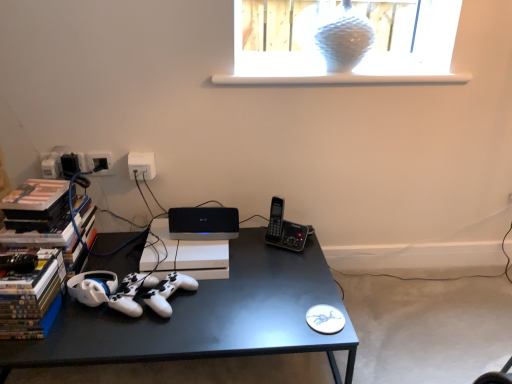
What are the coordinates of `vacant area to the right of white matte game controller at center` in the screenshot? It's located at (227, 302).